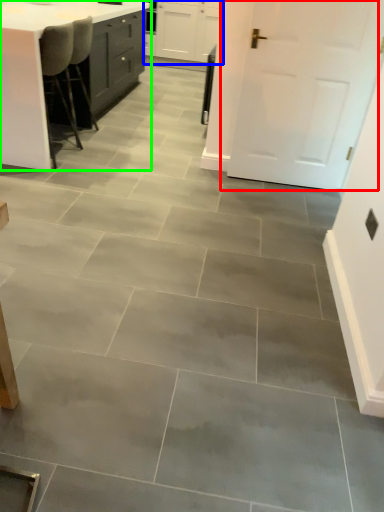
Question: Which is farther away from door (highlighted by a red box)? cabinetry (highlighted by a blue box) or table (highlighted by a green box)?

Choices:
 (A) cabinetry
 (B) table

Answer: (A)